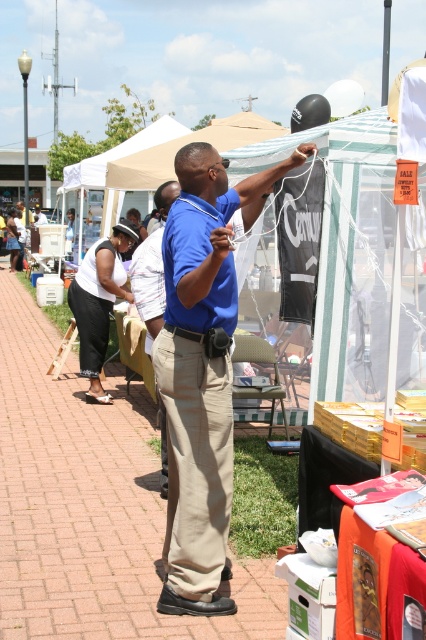
Can you confirm if white cotton pants at left is positioned to the right of white mesh canopy at upper center?

In fact, white cotton pants at left is to the left of white mesh canopy at upper center.

Can you confirm if white cotton pants at left is smaller than white mesh canopy at upper center?

Indeed, white cotton pants at left has a smaller size compared to white mesh canopy at upper center.

Identify the location of white cotton pants at left. The image size is (426, 640). (98, 301).

Consider the image. Measure the distance between point (175, 390) and camera.

They are 3.65 meters apart.

Between blue cotton shirt at center and white mesh canopy at upper center, which one has more height?

Standing taller between the two is blue cotton shirt at center.

Find the location of `blue cotton shirt at center`. blue cotton shirt at center is located at coordinates (201, 371).

This screenshot has height=640, width=426. I want to click on blue cotton shirt at center, so click(x=201, y=371).

The width and height of the screenshot is (426, 640). What do you see at coordinates (201, 371) in the screenshot?
I see `blue cotton shirt at center` at bounding box center [201, 371].

Is point (166, 556) farther from viewer compared to point (146, 284)?

No.

Is point (192, 429) closer to camera compared to point (163, 436)?

Yes, point (192, 429) is in front of point (163, 436).

Find the location of a particular element. This screenshot has height=640, width=426. blue cotton shirt at center is located at coordinates (201, 371).